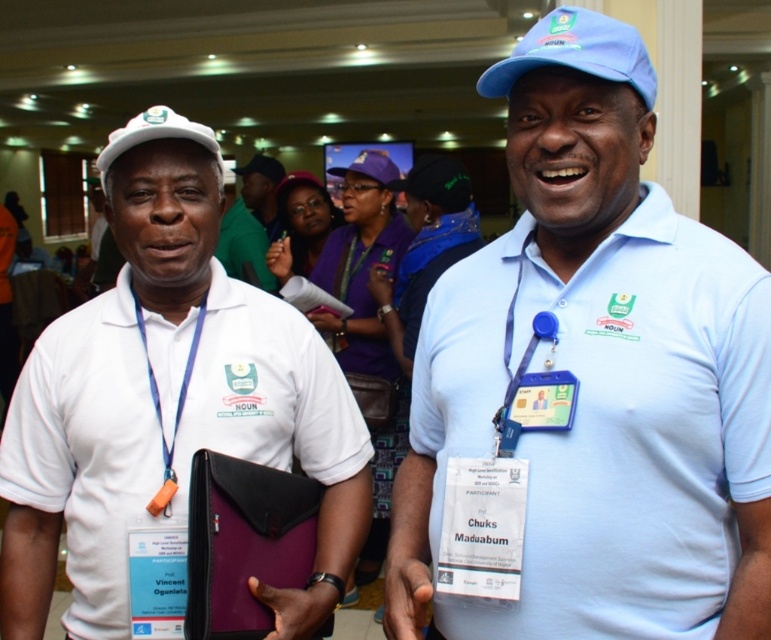
In the scene shown: Does white matte cap at upper left appear under blue fabric baseball cap at upper center?

Indeed, white matte cap at upper left is positioned under blue fabric baseball cap at upper center.

Does white matte cap at upper left have a smaller size compared to blue fabric baseball cap at upper center?

Actually, white matte cap at upper left might be larger than blue fabric baseball cap at upper center.

Does point (261, 296) come closer to viewer compared to point (642, 93)?

No, (261, 296) is further to viewer.

At what (x,y) coordinates should I click in order to perform the action: click on white matte cap at upper left. Please return your answer as a coordinate pair (x, y). The image size is (771, 640). Looking at the image, I should click on (167, 403).

Is point (133, 385) closer to viewer compared to point (241, 272)?

Yes, point (133, 385) is in front of point (241, 272).

Which is in front, point (123, 572) or point (258, 237)?

Point (123, 572) is in front.

Describe the element at coordinates (167, 403) in the screenshot. I see `white matte cap at upper left` at that location.

At what (x,y) coordinates should I click in order to perform the action: click on white matte cap at upper left. Please return your answer as a coordinate pair (x, y). Looking at the image, I should click on (167, 403).

Can you confirm if blue fabric baseball cap at upper center is positioned to the left of blue fabric lanyard at left?

Incorrect, blue fabric baseball cap at upper center is not on the left side of blue fabric lanyard at left.

Is the position of blue fabric baseball cap at upper center less distant than that of blue fabric lanyard at left?

Yes.

Describe the element at coordinates (576, 52) in the screenshot. The width and height of the screenshot is (771, 640). I see `blue fabric baseball cap at upper center` at that location.

Locate an element on the screen. The width and height of the screenshot is (771, 640). blue fabric baseball cap at upper center is located at coordinates (576, 52).